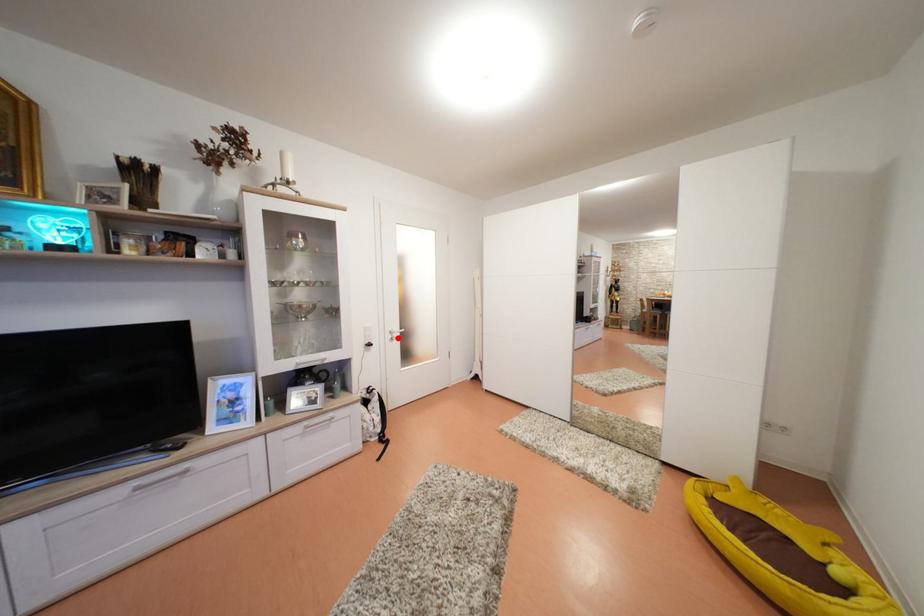
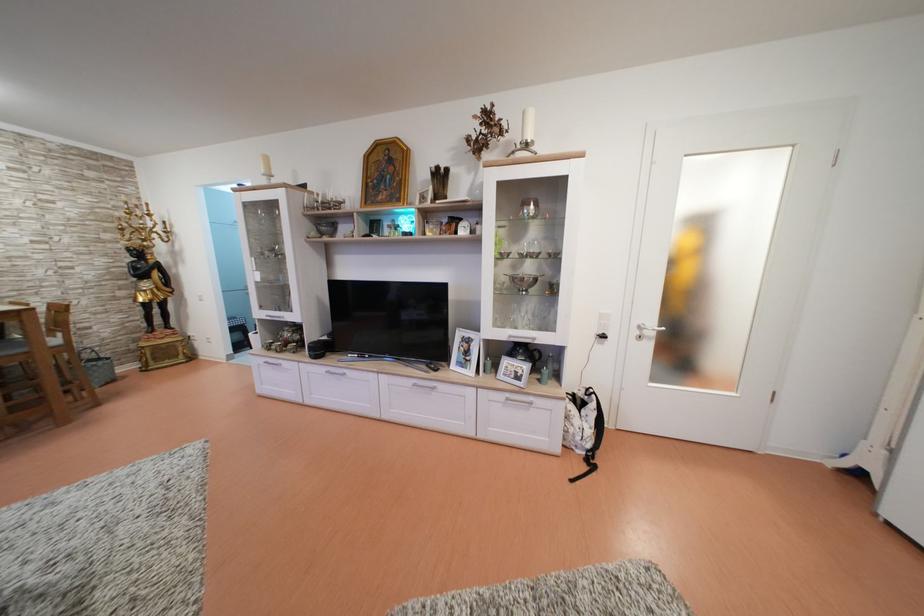
Where in the second image is the point corresponding to the highlighted location from the first image?

(647, 333)